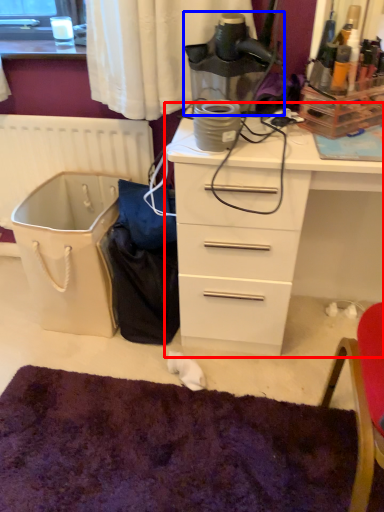
Question: Among these objects, which one is nearest to the camera, chest of drawers (highlighted by a red box) or appliance (highlighted by a blue box)?

Choices:
 (A) chest of drawers
 (B) appliance

Answer: (A)